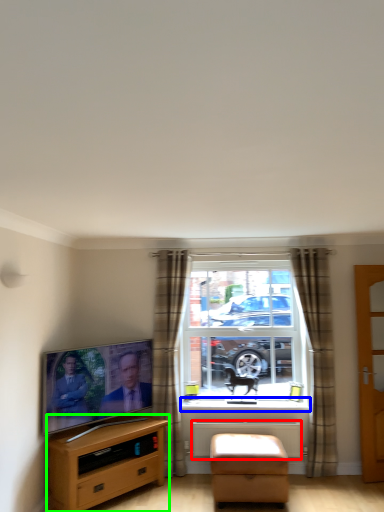
Question: Which object is the closest to the radiator (highlighted by a red box)? Choose among these: window sill (highlighted by a blue box) or cabinetry (highlighted by a green box).

Choices:
 (A) window sill
 (B) cabinetry

Answer: (A)